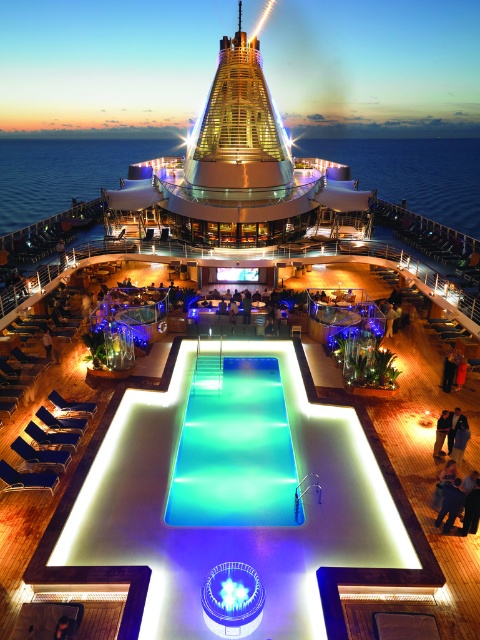
You are a passenger on the cruise ship and want to take a photo of both the shiny metallic cruise ship at upper center and the translucent glass pool at center. Which object will appear larger in your photo?

The shiny metallic cruise ship at upper center will appear larger in the photo because it is much taller than the translucent glass pool at center.

You are standing on the upper deck of the cruise ship and want to take a photo of the blue glossy pool at center and the shiny metallic cruise ship at upper center. Which object should you frame first in your camera to ensure both are in the shot?

The blue glossy pool at center is positioned on the right side of the shiny metallic cruise ship at upper center, so you should frame the shiny metallic cruise ship at upper center first to ensure both are included in the shot.